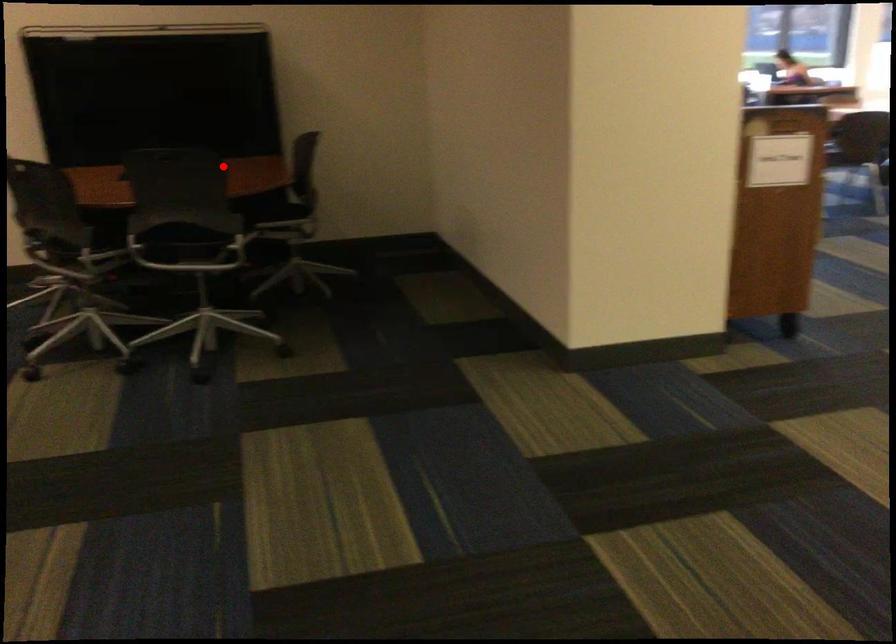
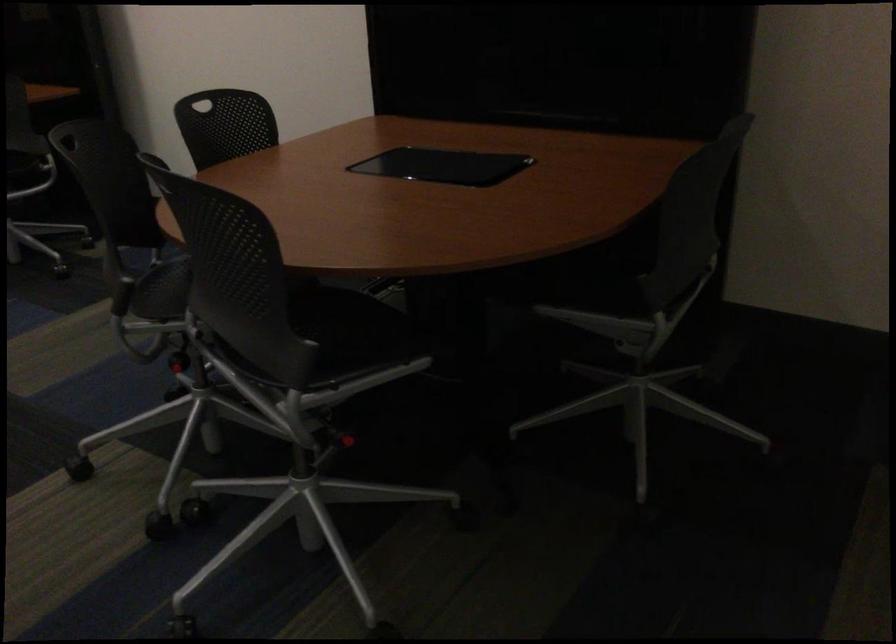
Question: A red point is marked in image1. In image2, is the corresponding 3D point closer to the camera or farther? Reply with the corresponding letter.

Choices:
 (A) The corresponding 3D point is closer.
 (B) The corresponding 3D point is farther.

Answer: (A)